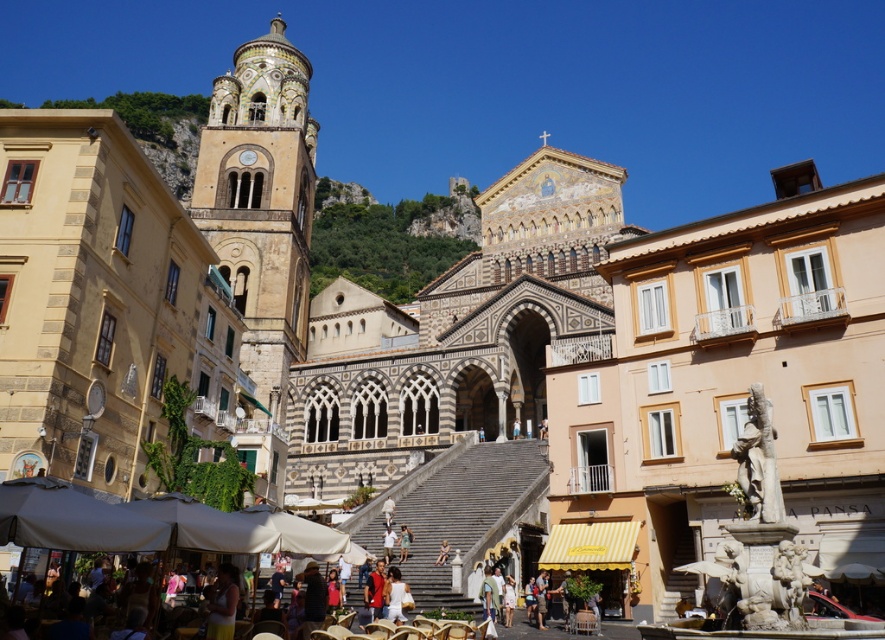
You are standing in the historic square and want to take a photo of both the point at coordinates (401, 554) and the point at (443, 554). Which point should you position closer to the camera to ensure both are visible in the frame?

To ensure both points are visible, position the point at (443, 554) closer to the camera since it is in front of the point at (401, 554).

You are standing in the square and want to take a photo of the multicolored mosaic church at center. If you are at position 0.5, 0.5, which direction should you move to get the best view?

Since the multicolored mosaic church at center is located at position (458, 336), you should move slightly to the northeast to align with its position for the best view.